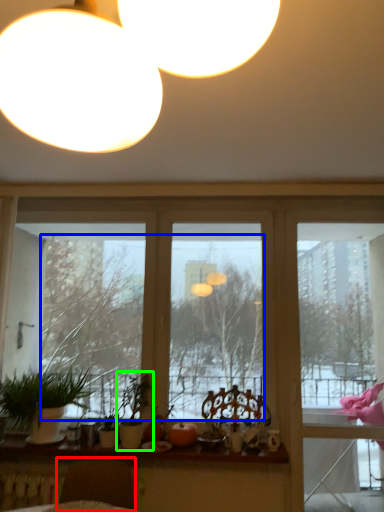
Question: Which object is positioned farthest from swivel chair (highlighted by a red box)? Select from tree (highlighted by a blue box) and houseplant (highlighted by a green box).

Choices:
 (A) tree
 (B) houseplant

Answer: (A)